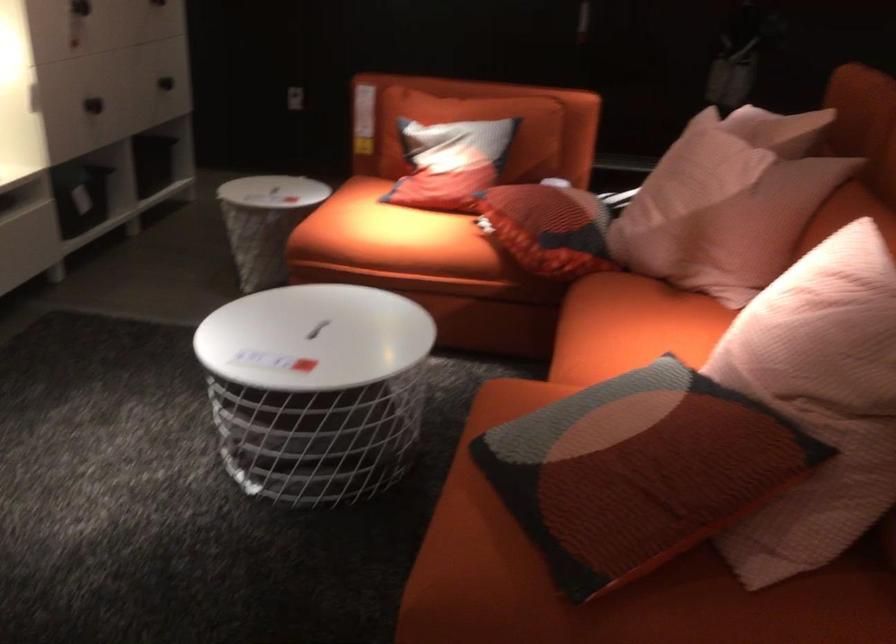
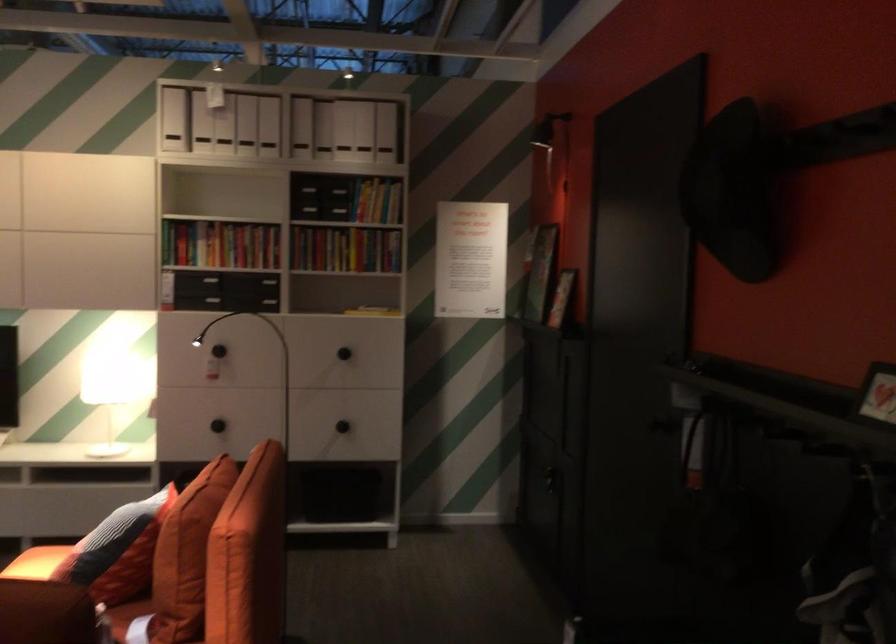
Locate, in the second image, the point that corresponds to point 383,207 in the first image.

(36, 563)